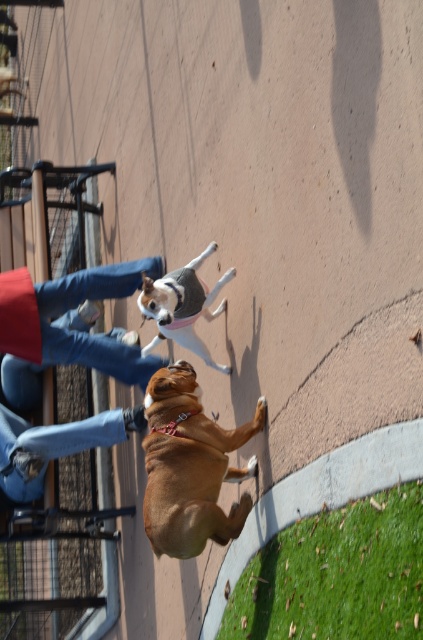
Question: Which point is closer to the camera taking this photo?

Choices:
 (A) (7, 412)
 (B) (112, 269)
 (C) (208, 444)

Answer: (C)

Question: Can you confirm if denim pants at center is positioned below soft gray sweater at center?

Choices:
 (A) yes
 (B) no

Answer: (A)

Question: Which of these objects is positioned farthest from the soft gray sweater at center?

Choices:
 (A) brown leather dog at center
 (B) denim pants at center
 (C) jeans at lower left

Answer: (C)

Question: Does jeans at lower left have a lesser width compared to soft gray sweater at center?

Choices:
 (A) yes
 (B) no

Answer: (B)

Question: Is denim pants at center wider than soft gray sweater at center?

Choices:
 (A) no
 (B) yes

Answer: (B)

Question: Based on their relative distances, which object is farther from the soft gray sweater at center?

Choices:
 (A) brown leather dog at center
 (B) jeans at lower left

Answer: (B)